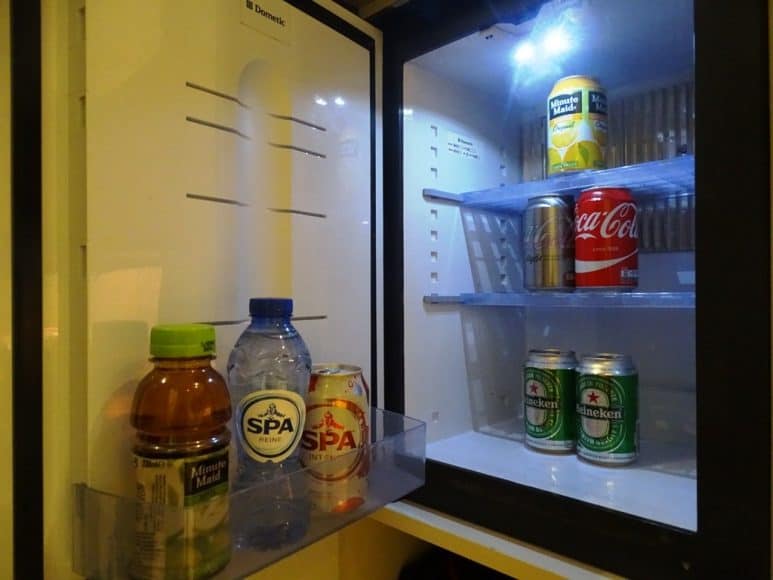
You are a GUI agent. You are given a task and a screenshot of the screen. Output one action in this format:
    pyautogui.click(x=<x>, y=<y>)
    Task: Click on the clear shelfs
    The width and height of the screenshot is (773, 580).
    Given the screenshot: What is the action you would take?
    506,188, 506,293